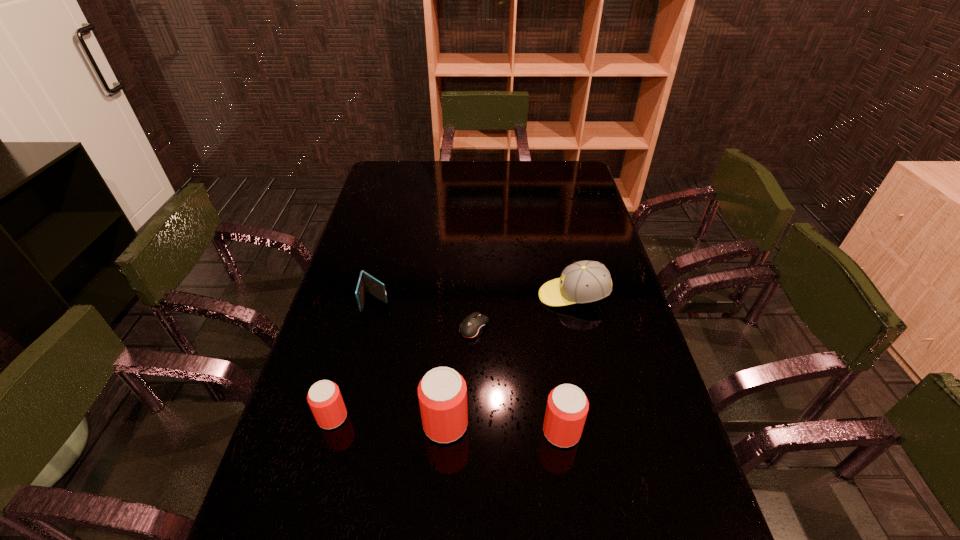
I want to click on vacant space situated 0.060m on the front of the second tallest beer can, so click(568, 476).

This screenshot has height=540, width=960. Find the location of `vacant area situated 0.230m on the exterior surface of the wallet`. vacant area situated 0.230m on the exterior surface of the wallet is located at coordinates (357, 377).

Where is `blank area located 0.370m on the left of the computer mouse`? The height and width of the screenshot is (540, 960). blank area located 0.370m on the left of the computer mouse is located at coordinates (332, 328).

Locate an element on the screen. The height and width of the screenshot is (540, 960). vacant space located 0.290m on the front-facing side of the baseball cap is located at coordinates (445, 296).

The image size is (960, 540). Find the location of `free spot located 0.270m on the front-facing side of the baseball cap`. free spot located 0.270m on the front-facing side of the baseball cap is located at coordinates (452, 296).

In order to click on free space located 0.070m on the front-facing side of the baseball cap in this screenshot , I will do 516,296.

At what (x,y) coordinates should I click in order to perform the action: click on beer can located in the left edge section of the desktop. Please return your answer as a coordinate pair (x, y). This screenshot has height=540, width=960. Looking at the image, I should click on (324, 398).

Identify the location of wallet positioned at the left edge. The image size is (960, 540). (367, 283).

Where is `object present at the right edge`? object present at the right edge is located at coordinates (582, 282).

In the image, there is a desktop. At what (x,y) coordinates should I click in order to perform the action: click on vacant space at the far edge. Please return your answer as a coordinate pair (x, y). This screenshot has width=960, height=540. Looking at the image, I should click on (451, 162).